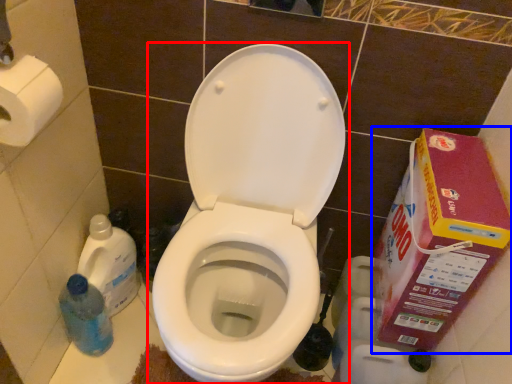
Question: Among these objects, which one is farthest to the camera, toilet (highlighted by a red box) or cardboard box (highlighted by a blue box)?

Choices:
 (A) toilet
 (B) cardboard box

Answer: (B)